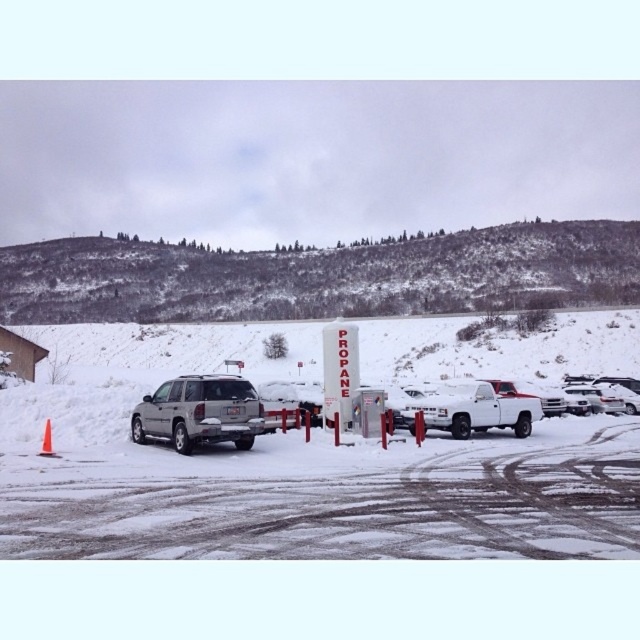
In order to click on satin silver suv at center in this screenshot , I will do `click(198, 412)`.

Between satin silver suv at center and white matte truck at center, which one has less height?

With less height is white matte truck at center.

Between point (237, 417) and point (470, 420), which one is positioned in front?

Point (237, 417) is more forward.

Where is `satin silver suv at center`? The height and width of the screenshot is (640, 640). satin silver suv at center is located at coordinates 198,412.

What are the coordinates of `satin silver suv at center` in the screenshot? It's located at (198, 412).

Who is lower down, white matte truck at center or orange plastic cone at lower left?

white matte truck at center is lower down.

Between point (490, 410) and point (45, 422), which one is positioned in front?

Point (45, 422)

The width and height of the screenshot is (640, 640). I want to click on white matte truck at center, so click(474, 410).